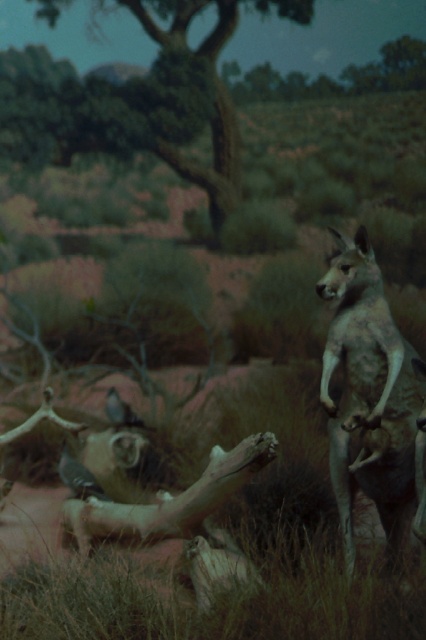
You are a visitor at the museum exhibit and want to take a photo of the matte gray bird at lower left and the shiny blue bird at lower left. Which bird will appear bigger in your photo?

The matte gray bird at lower left is larger in size than the shiny blue bird at lower left, so it will appear bigger in the photo.

You are an observer looking at the diorama. You notice the green leafy tree at upper center and the shiny blue bird at lower left. Which object is taller?

The green leafy tree at upper center is taller than the shiny blue bird at lower left.